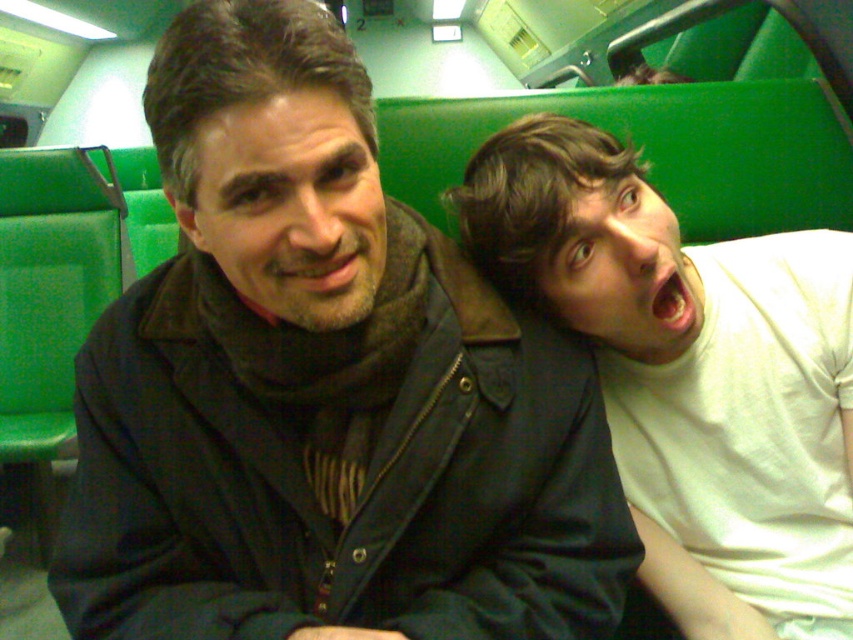
Between dark blue jacket at center and white matte shirt at right, which one is positioned lower?

Positioned lower is white matte shirt at right.

This screenshot has height=640, width=853. What do you see at coordinates (322, 388) in the screenshot? I see `dark blue jacket at center` at bounding box center [322, 388].

Which is in front, point (218, 353) or point (524, 225)?

Point (218, 353) is in front.

Find the location of a particular element. The height and width of the screenshot is (640, 853). dark blue jacket at center is located at coordinates (322, 388).